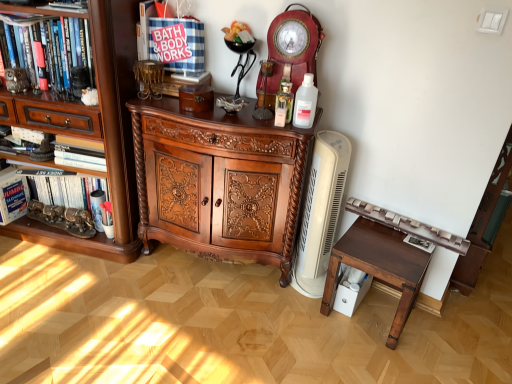
This screenshot has height=384, width=512. What do you see at coordinates (321, 212) in the screenshot? I see `white plastic heater at right` at bounding box center [321, 212].

Image resolution: width=512 pixels, height=384 pixels. What do you see at coordinates (16, 80) in the screenshot?
I see `metallic owl at left` at bounding box center [16, 80].

What is the approximate width of clear plastic bottle at center?

The width of clear plastic bottle at center is 4.80 inches.

This screenshot has width=512, height=384. Describe the element at coordinates (291, 50) in the screenshot. I see `matte red wooden clock at upper center` at that location.

What are the coordinates of `dark wood carved cabinet at center` in the screenshot? It's located at (218, 182).

Locate an element on the screen. brown wood cabinet at left is located at coordinates (94, 129).

Find the location of a particular element. white plastic heater at right is located at coordinates (321, 212).

Is brown wood cabinet at left touching white plastic heater at right?

No, brown wood cabinet at left is not in contact with white plastic heater at right.

Between brown wood cabinet at left and white plastic heater at right, which one has more height?

brown wood cabinet at left.

Which is more to the left, brown wood cabinet at left or white plastic heater at right?

Positioned to the left is brown wood cabinet at left.

Is brown wood cabinet at left turned away from white plastic heater at right?

That's not correct — brown wood cabinet at left is not looking away from white plastic heater at right.

Is there a large distance between metallic owl at left and dark brown wooden table at right?

metallic owl at left is far away from dark brown wooden table at right.

What's the angular difference between metallic owl at left and dark brown wooden table at right's facing directions?

62.8 degrees separate the facing orientations of metallic owl at left and dark brown wooden table at right.

Between metallic owl at left and dark brown wooden table at right, which one has less height?

metallic owl at left.

Does metallic owl at left lie in front of dark brown wooden table at right?

No, it is not.

You are a GUI agent. You are given a task and a screenshot of the screen. Output one action in this format:
    pyautogui.click(x=<x>, y=<y>)
    Task: Click on the table located behind the brown wood cabinet at left
    The image size is (512, 384).
    Given the screenshot: What is the action you would take?
    pyautogui.click(x=379, y=267)

Is dark brown wooden table at right not close to brown wood cabinet at left?

Indeed, dark brown wooden table at right is not near brown wood cabinet at left.

Which is in front, dark brown wooden table at right or brown wood cabinet at left?

brown wood cabinet at left.

From the picture: From the image's perspective, is dark brown wooden table at right above brown wood cabinet at left?

Actually, dark brown wooden table at right appears below brown wood cabinet at left in the image.

Is clear plastic bottle at center bigger or smaller than matte red wooden clock at upper center?

Considering their sizes, clear plastic bottle at center takes up less space than matte red wooden clock at upper center.

From a real-world perspective, is clear plastic bottle at center positioned over matte red wooden clock at upper center based on gravity?

No, from a real-world perspective, clear plastic bottle at center is not above matte red wooden clock at upper center.

Considering the positions of objects clear plastic bottle at center and matte red wooden clock at upper center in the image provided, who is more to the left, clear plastic bottle at center or matte red wooden clock at upper center?

From the viewer's perspective, matte red wooden clock at upper center appears more on the left side.

Is clear plastic bottle at center facing towards matte red wooden clock at upper center?

No, clear plastic bottle at center does not turn towards matte red wooden clock at upper center.

Does point (323, 36) come in front of point (84, 70)?

Yes, it is in front of point (84, 70).

Based on their sizes in the image, would you say matte red wooden clock at upper center is bigger or smaller than brown wood bookshelf at left?

matte red wooden clock at upper center is smaller than brown wood bookshelf at left.

Identify the location of shelf behind the matte red wooden clock at upper center. (48, 50).

From the image's perspective, would you say matte red wooden clock at upper center is shown under brown wood bookshelf at left?

Yes, from the image's perspective, matte red wooden clock at upper center is below brown wood bookshelf at left.

Considering the positions of objects metallic owl at left and white plastic heater at right in the image provided, who is in front, metallic owl at left or white plastic heater at right?

Positioned in front is white plastic heater at right.

Is metallic owl at left facing away from white plastic heater at right?

No, metallic owl at left's orientation is not away from white plastic heater at right.

Considering the sizes of metallic owl at left and white plastic heater at right in the image, is metallic owl at left bigger or smaller than white plastic heater at right?

Clearly, metallic owl at left is smaller in size than white plastic heater at right.

Based on the photo, between metallic owl at left and white plastic heater at right, which one appears on the right side from the viewer's perspective?

From the viewer's perspective, white plastic heater at right appears more on the right side.

From the image's perspective, who appears lower, dark wood carved cabinet at center or matte red wooden clock at upper center?

From the image's view, dark wood carved cabinet at center is below.

Is dark wood carved cabinet at center aimed at matte red wooden clock at upper center?

No.

Which is farther, (169, 162) or (284, 71)?

Point (169, 162)

From a real-world perspective, is dark wood carved cabinet at center physically below matte red wooden clock at upper center?

Yes, from a real-world perspective, dark wood carved cabinet at center is below matte red wooden clock at upper center.

The height and width of the screenshot is (384, 512). What are the coordinates of `appliance below the brown wood cabinet at left (from a real-world perspective)` in the screenshot? It's located at (321, 212).

The height and width of the screenshot is (384, 512). Find the location of `toy behind the dark brown wooden table at right`. toy behind the dark brown wooden table at right is located at coordinates (16, 80).

From the image, which object appears to be nearer to brown wood bookshelf at left, clear plastic bottle at center or white plastic heater at right?

clear plastic bottle at center is positioned closer to the anchor brown wood bookshelf at left.

When comparing their distances from hardcover book at left, the 1th book when ordered from right to left, does white cardboard box at left, acting as the 2th book starting from the right, or brown wood cabinet at left seem further?

The object further to hardcover book at left, the 1th book when ordered from right to left, is brown wood cabinet at left.

Considering their positions, is metallic owl at left positioned further to dark wood carved cabinet at center than white plastic heater at right?

metallic owl at left.

Looking at the image, which one is located further to white plastic heater at right, matte red wooden clock at upper center or brown wood cabinet at left?

brown wood cabinet at left is further to white plastic heater at right.

Based on their spatial positions, is hardcover book at left, the 1th book when ordered from right to left, or metallic owl at left closer to clear plastic bottle at center?

The object closer to clear plastic bottle at center is metallic owl at left.

Estimate the real-world distances between objects in this image. Which object is further from hardcover book at left, which ranks as the second book in left-to-right order, clear plastic bottle at center or brown wood bookshelf at left?

clear plastic bottle at center.

Which object lies nearer to the anchor point metallic owl at left, dark brown wooden table at right or white cardboard box at left, which is the 1th book from left to right?

white cardboard box at left, which is the 1th book from left to right, lies closer to metallic owl at left than the other object.

From the picture: Considering their positions, is white cardboard box at left, which is the 1th book from left to right, positioned further to clear plastic bottle at center than hardcover book at left, the 1th book when ordered from right to left?

Among the two, white cardboard box at left, which is the 1th book from left to right, is located further to clear plastic bottle at center.

This screenshot has width=512, height=384. I want to click on toy between hardcover book at left, which ranks as the second book in left-to-right order, and matte red wooden clock at upper center from left to right, so click(16, 80).

Locate an element on the screen. The width and height of the screenshot is (512, 384). clock between white cardboard box at left, which is the 1th book from left to right, and clear plastic bottle at center from left to right is located at coordinates (291, 50).

Locate an element on the screen. shelf located between brown wood cabinet at left and white plastic heater at right in the left-right direction is located at coordinates (48, 50).

The height and width of the screenshot is (384, 512). Identify the location of toy between brown wood cabinet at left and white cardboard box at left, which is the 1th book from left to right, from front to back. (16, 80).